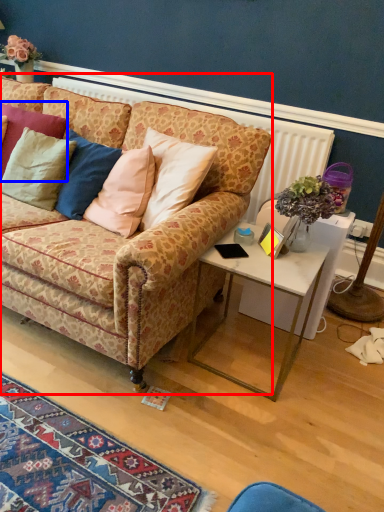
Question: Which object appears farthest to the camera in this image, studio couch (highlighted by a red box) or pillow (highlighted by a blue box)?

Choices:
 (A) studio couch
 (B) pillow

Answer: (B)